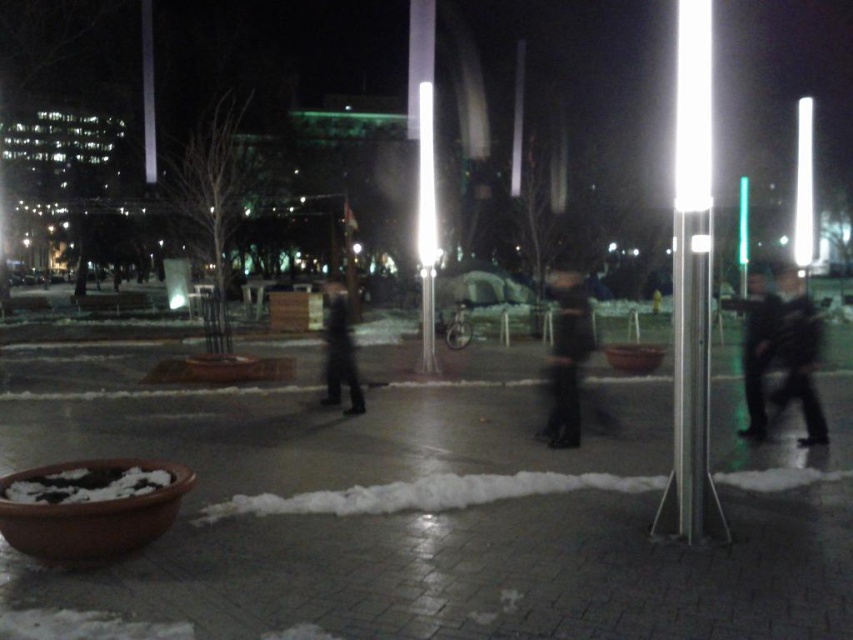
Question: Can you confirm if white glossy pole at center is wider than dark gray fabric jacket at right?

Choices:
 (A) no
 (B) yes

Answer: (B)

Question: Which object is positioned farthest from the dark gray fabric jacket at right?

Choices:
 (A) dark fabric jacket at right
 (B) dark blue fabric pants at center

Answer: (A)

Question: Which is farther from the dark gray fabric jacket at right?

Choices:
 (A) dark blue fabric pants at center
 (B) white glossy pole at center
 (C) white glossy pole at right
 (D) dark fabric jacket at right

Answer: (B)

Question: Which point is closer to the camera?

Choices:
 (A) dark gray fabric jacket at right
 (B) white glossy pole at right
 (C) dark fabric jacket at right

Answer: (B)

Question: Does white glossy pole at center have a greater width compared to dark blue fabric pants at center?

Choices:
 (A) yes
 (B) no

Answer: (B)

Question: Is dark fabric jacket at right to the right of dark fabric jacket at center from the viewer's perspective?

Choices:
 (A) yes
 (B) no

Answer: (A)